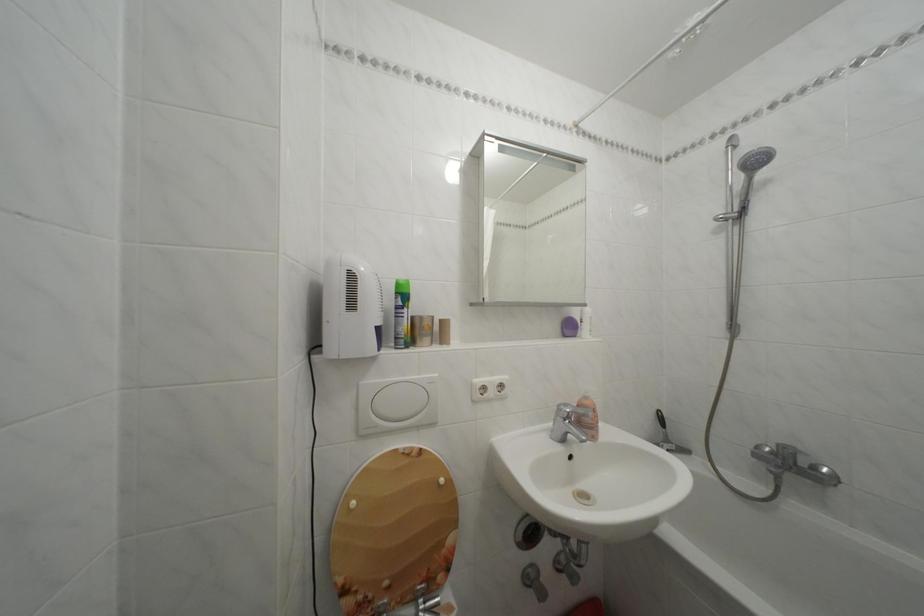
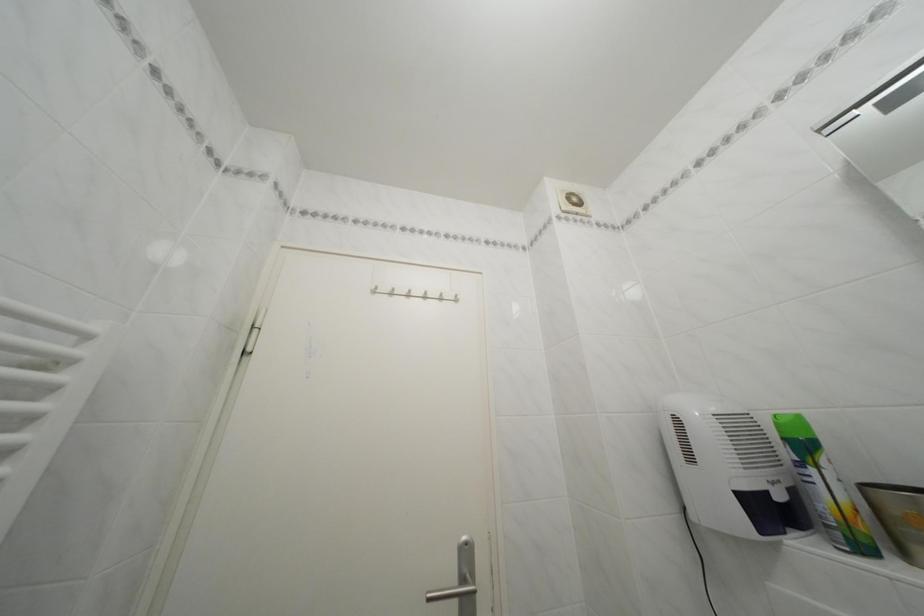
Find the pixel in the second image that matches (x=360, y=312) in the first image.

(699, 464)